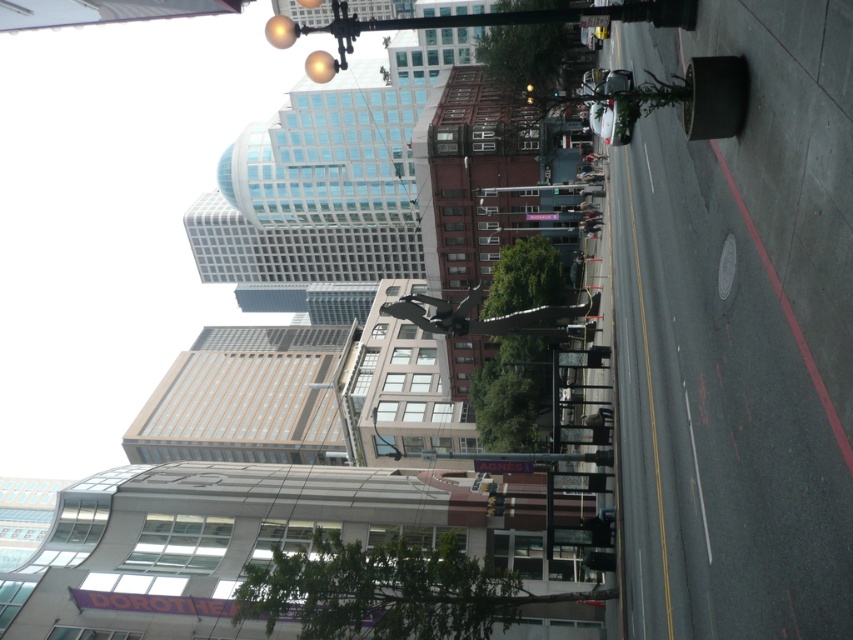
Does metallic traffic light at center have a larger size compared to metallic traffic light at upper center?

Incorrect, metallic traffic light at center is not larger than metallic traffic light at upper center.

Does metallic traffic light at center appear under metallic traffic light at upper center?

Indeed, metallic traffic light at center is positioned under metallic traffic light at upper center.

Is point (495, 496) farther from camera compared to point (607, 32)?

No, it is not.

This screenshot has height=640, width=853. In order to click on metallic traffic light at center in this screenshot , I will do `click(495, 504)`.